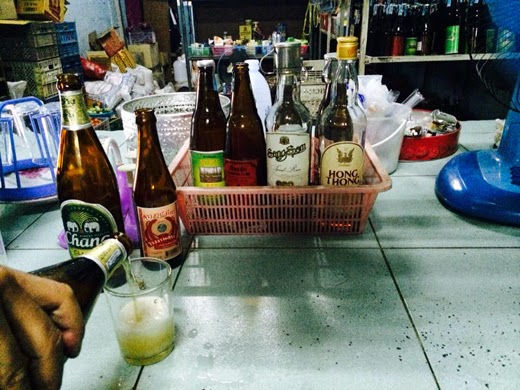
You are a GUI agent. You are given a task and a screenshot of the screen. Output one action in this format:
    pyautogui.click(x=<x>, y=<y>)
    Task: Click on the glass
    This screenshot has width=520, height=390.
    Given the screenshot: What is the action you would take?
    pyautogui.click(x=133, y=306)